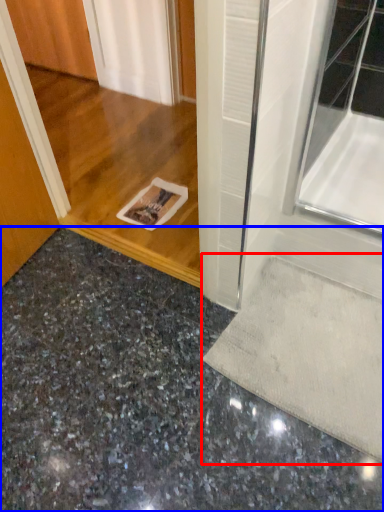
Question: Among these objects, which one is nearest to the camera, doormat (highlighted by a red box) or concrete (highlighted by a blue box)?

Choices:
 (A) doormat
 (B) concrete

Answer: (B)